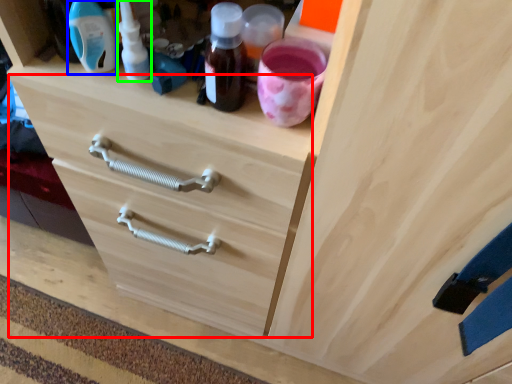
Question: Which object is the farthest from drawer (highlighted by a red box)? Choose among these: bottle (highlighted by a blue box) or bottle (highlighted by a green box).

Choices:
 (A) bottle
 (B) bottle

Answer: (A)